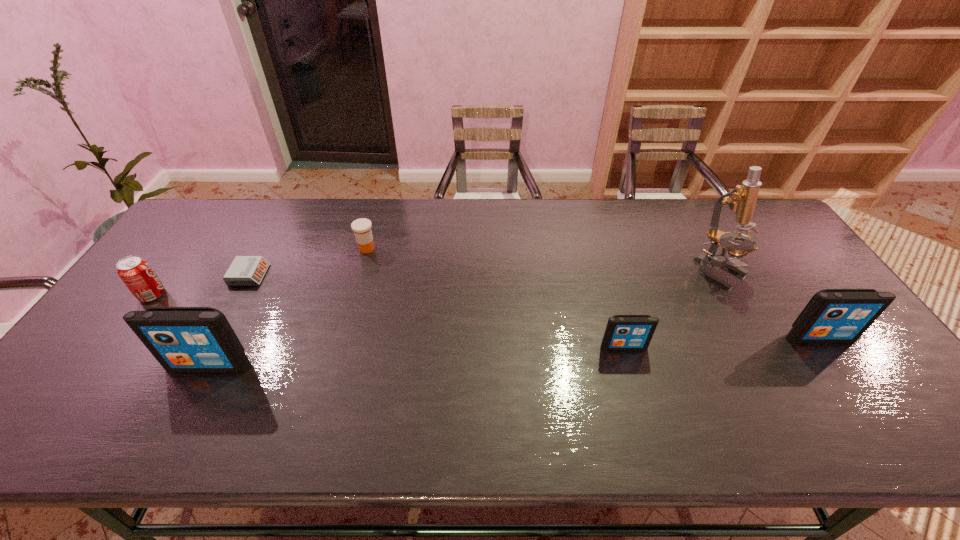
Locate an element on the screen. The height and width of the screenshot is (540, 960). vacant area in the image that satisfies the following two spatial constraints: 1. on the label of the tallest object; 2. on the right side of the fourth object from right to left is located at coordinates (360, 271).